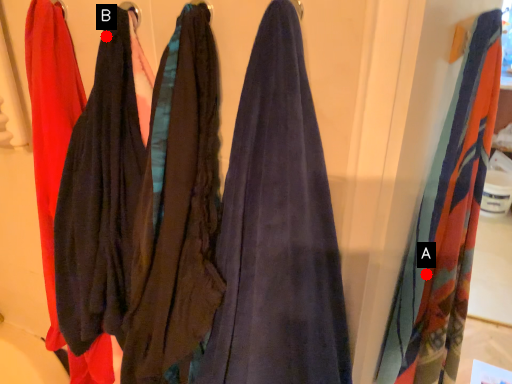
Question: Two points are circled on the image, labeled by A and B beside each circle. Which of the following is the farthest from the observer?

Choices:
 (A) A is further
 (B) B is further

Answer: (A)